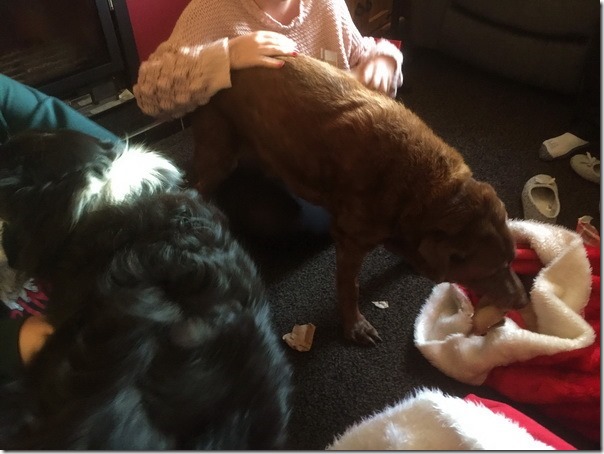
What are the coordinates of `dark brown carpeting` in the screenshot? It's located at (361, 379).